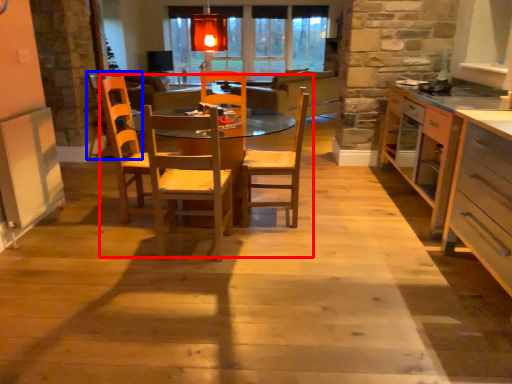
Question: Which object is further to the camera taking this photo, kitchen & dining room table (highlighted by a red box) or armchair (highlighted by a blue box)?

Choices:
 (A) kitchen & dining room table
 (B) armchair

Answer: (B)